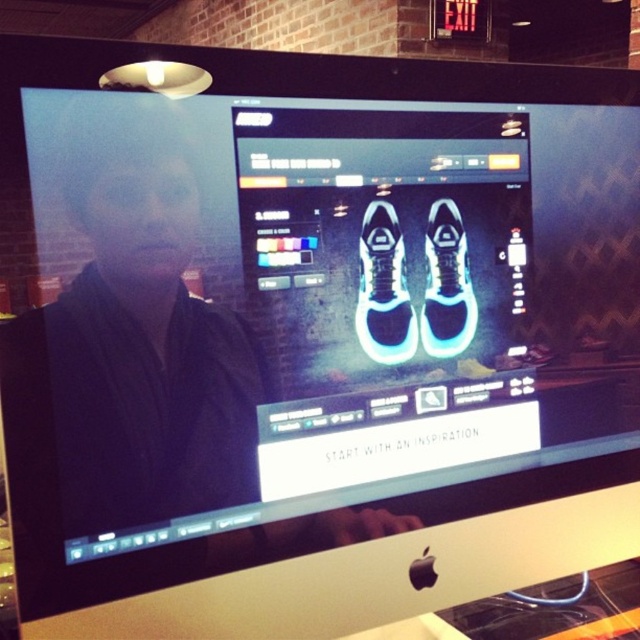
You are using the sneaker customization interface and want to adjust the left sneaker. Which one is the left sneaker between the white matte sneakers at center and the white matte sneaker at center?

The white matte sneakers at center is the left sneaker because it is closer to the viewer than the white matte sneaker at center.

You are a designer working on a sneaker customization project. You have two white sneakers to compare on your screen. The first is labeled as white matte sneakers at center and the second as white matte sneaker at center. Which of these two sneakers takes up more horizontal space on the screen?

The white matte sneakers at center takes up more horizontal space on the screen because its width is larger than that of the white matte sneaker at center.